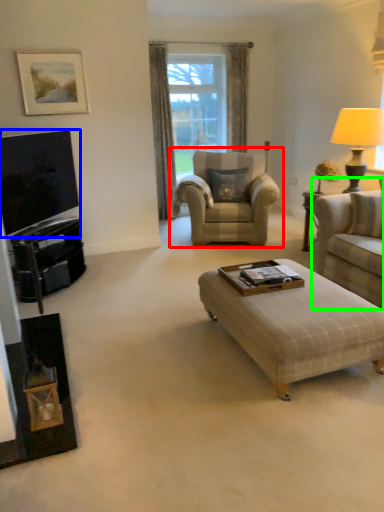
Question: Estimate the real-world distances between objects in this image. Which object is farther from chair (highlighted by a red box), television (highlighted by a blue box) or studio couch (highlighted by a green box)?

Choices:
 (A) television
 (B) studio couch

Answer: (A)